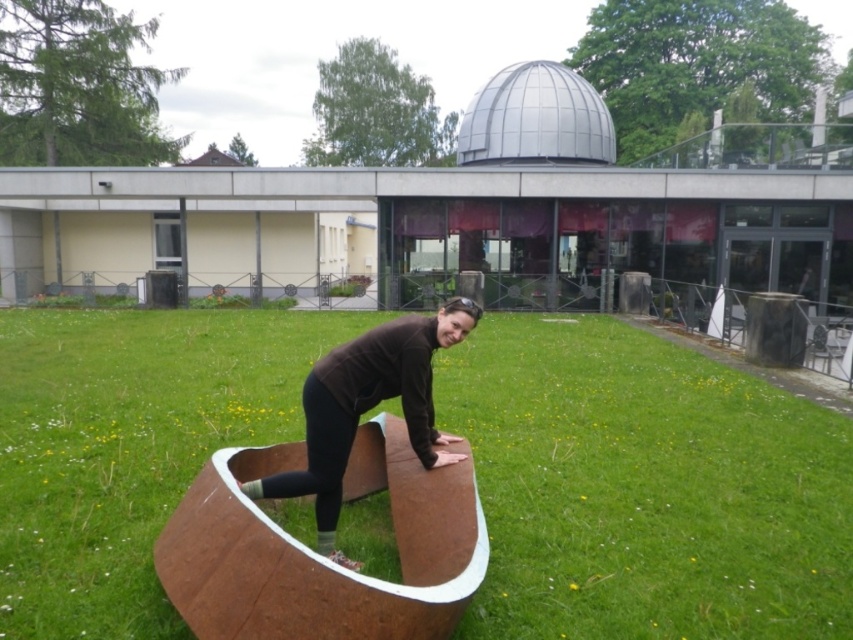
You are planning to have a picnic in the park and need to choose between the green grass at center and the brown matte bench at center. Which surface would you choose if you want more space to spread out your picnic blanket?

The green grass at center has a larger size compared to the brown matte bench at center, so you should choose the green grass at center for more space to spread out your picnic blanket.

In the scene shown: You are standing in the outdoor area and want to sit down. There is green grass at center and brown matte bench at center. Which one is more suitable for sitting?

The brown matte bench at center is more suitable for sitting because the green grass at center is positioned over it, indicating the bench is beneath the grass and likely not accessible.